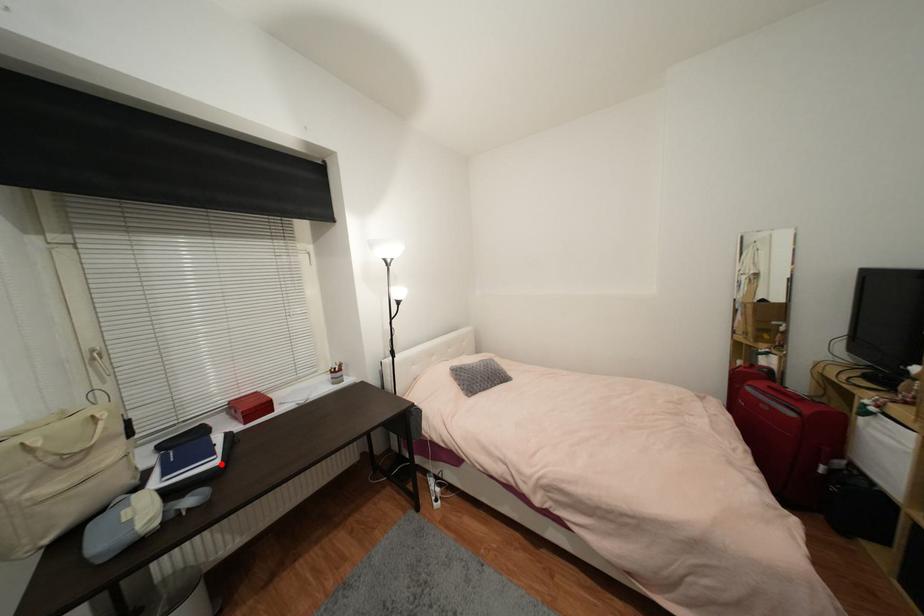
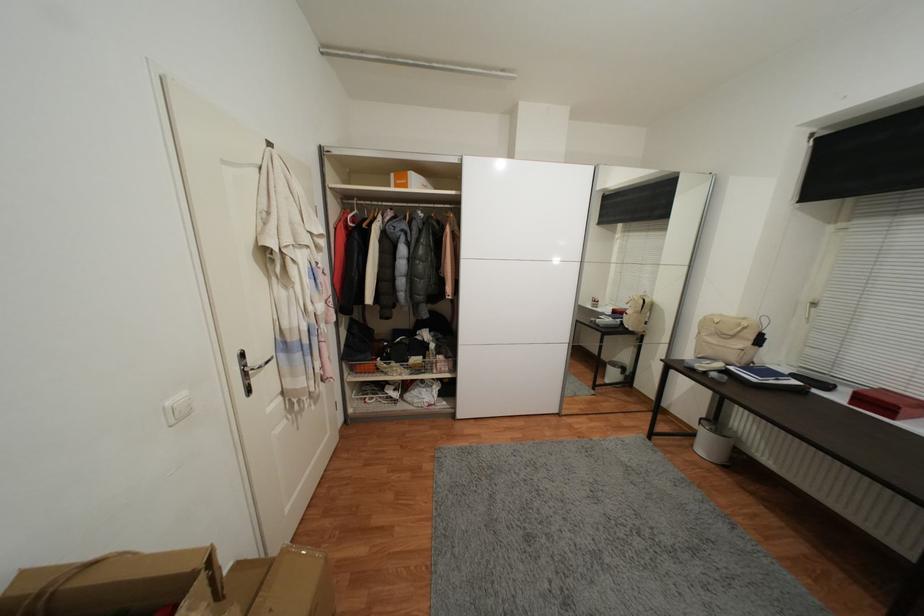
Question: I am providing you with two images of the same scene from different viewpoints. A red point is marked on the first image. At the location where the point appears in image 1, is it still visible in image 2?

Choices:
 (A) Yes
 (B) No

Answer: (A)